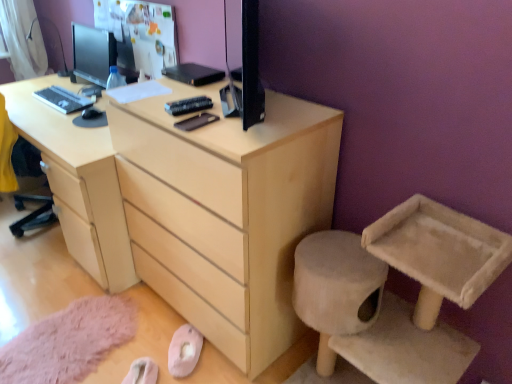
Where is `free spot in front of matte black keyboard at left`? The width and height of the screenshot is (512, 384). free spot in front of matte black keyboard at left is located at coordinates (42, 107).